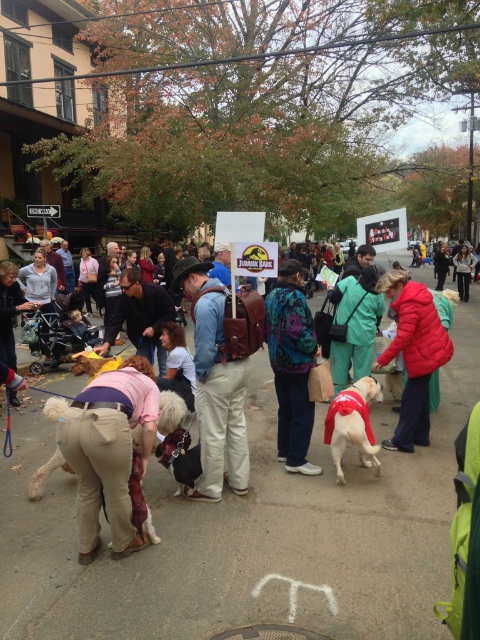
You are organizing a pet photo shoot and need to position the white fluffy dog at lower left and the fluffy beige dog at center in a line. Which dog should be placed to the left of the other to match the original image?

The white fluffy dog at lower left should be placed to the left of the fluffy beige dog at center to match the original image.

You are a drone operator trying to capture a photo of the teal patterned sweater at center from above. What coordinates should you aim for to ensure the sweater is centered in the photo?

The coordinates for the teal patterned sweater at center are at point (291, 364). Aim the drone to that point to center the sweater in the photo.

You are a photographer at the Jurassic Bark event. You need to capture a photo where both the white fluffy dog at lower left and the fluffy beige dog at center are visible. Based on their positions, which dog should be placed higher in the frame to ensure both are in the shot?

The white fluffy dog at lower left is above the fluffy beige dog at center, so placing the white fluffy dog at lower left higher in the frame will ensure both dogs are visible.